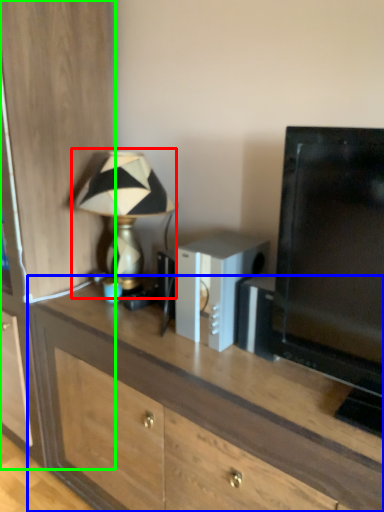
Question: Which object is positioned closest to lamp (highlighted by a red box)? Select from desk (highlighted by a blue box) and cabinetry (highlighted by a green box).

Choices:
 (A) desk
 (B) cabinetry

Answer: (B)